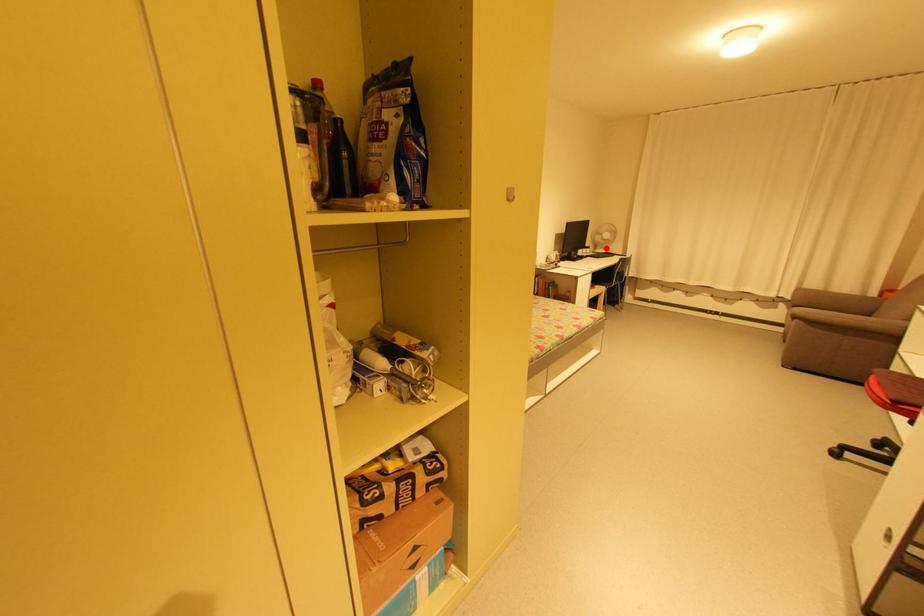
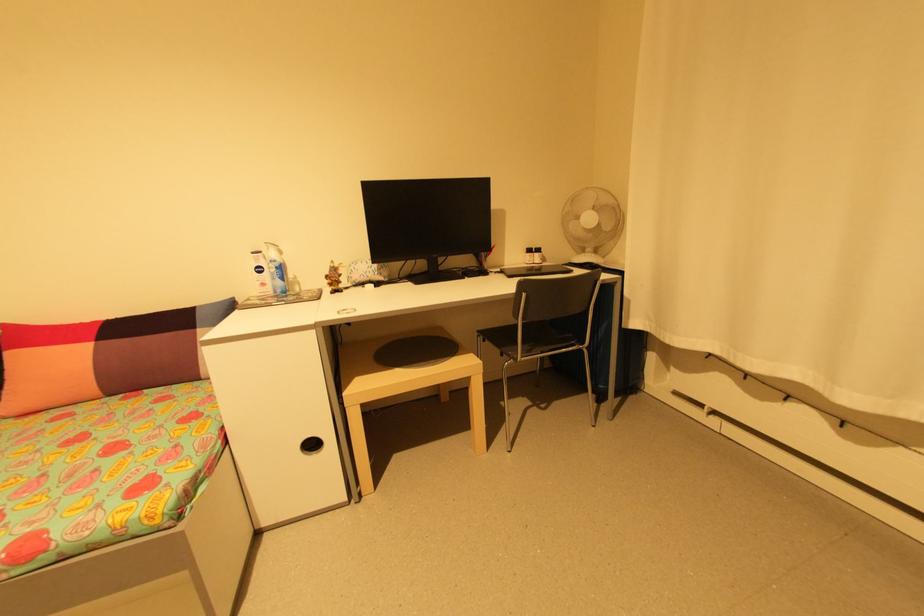
In the second image, find the point that corresponds to the highlighted location in the first image.

(600, 252)